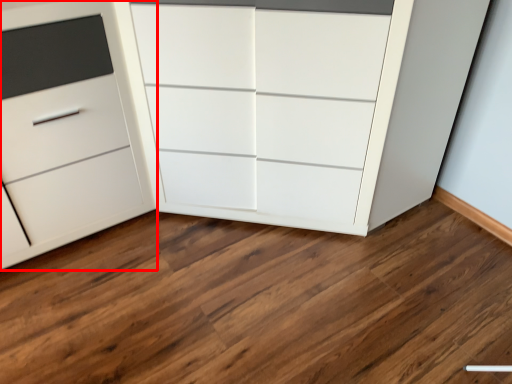
Question: From the image's perspective, where is chest of drawers (annotated by the red box) located relative to chest of drawers?

Choices:
 (A) above
 (B) below

Answer: (B)